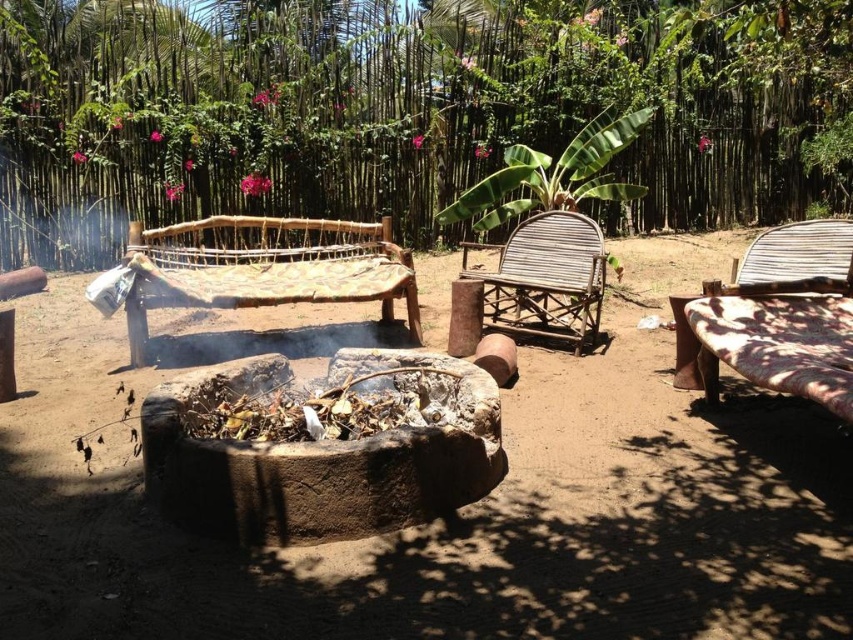
Who is more distant from viewer, (447, 611) or (91, 124)?

The point (91, 124) is more distant.

Identify the location of dull brown dirt at center. (460, 513).

Who is more distant from viewer, (9,637) or (126,193)?

The point (126,193) is behind.

Locate an element on the screen. The image size is (853, 640). dull brown dirt at center is located at coordinates (460, 513).

Does point (171, 516) come closer to viewer compared to point (167, 252)?

Yes, it is.

Is point (280, 536) farther from camera compared to point (265, 301)?

No, it is in front of (265, 301).

Is point (424, 397) less distant than point (283, 237)?

That is True.

Where is `earthy stone fire pit at center`? This screenshot has width=853, height=640. earthy stone fire pit at center is located at coordinates (325, 452).

Is dull brown dirt at center below natural wood woven chair at center?

Yes, dull brown dirt at center is below natural wood woven chair at center.

Find the location of a particular element. dull brown dirt at center is located at coordinates (460, 513).

This screenshot has height=640, width=853. What do you see at coordinates (460, 513) in the screenshot?
I see `dull brown dirt at center` at bounding box center [460, 513].

At what (x,y) coordinates should I click in order to perform the action: click on dull brown dirt at center. Please return your answer as a coordinate pair (x, y). This screenshot has height=640, width=853. Looking at the image, I should click on (460, 513).